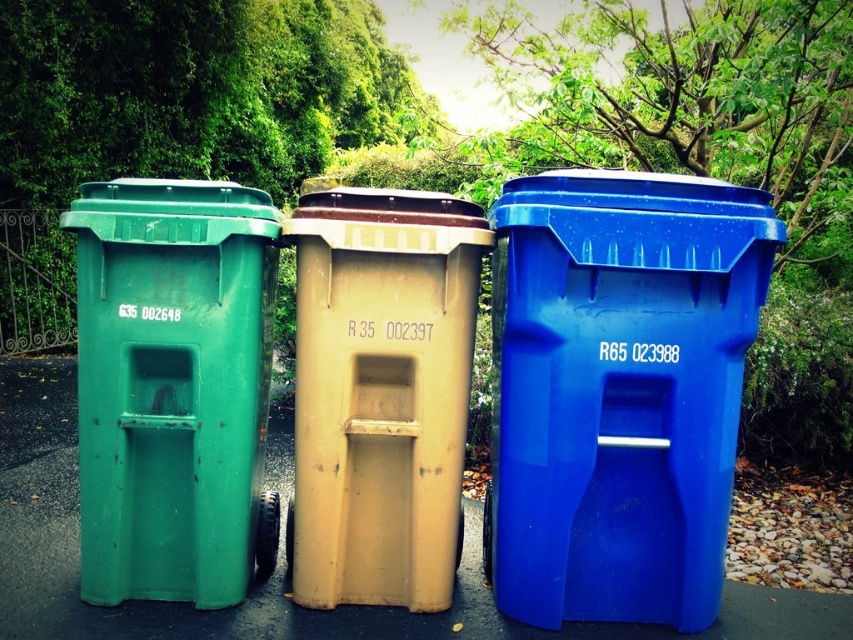
Question: Based on their relative distances, which object is farther from the blue plastic bin at center?

Choices:
 (A) green plastic bin at left
 (B) matte beige bin at center

Answer: (A)

Question: Does green plastic bin at left come behind matte beige bin at center?

Choices:
 (A) yes
 (B) no

Answer: (B)

Question: Can you confirm if blue plastic bin at center is wider than green plastic bin at left?

Choices:
 (A) no
 (B) yes

Answer: (A)

Question: Does green plastic bin at left have a greater width compared to matte beige bin at center?

Choices:
 (A) yes
 (B) no

Answer: (A)

Question: Which of the following is the farthest from the observer?

Choices:
 (A) green plastic bin at left
 (B) blue plastic bin at center

Answer: (A)

Question: Among these objects, which one is nearest to the camera?

Choices:
 (A) green plastic bin at left
 (B) matte beige bin at center

Answer: (A)